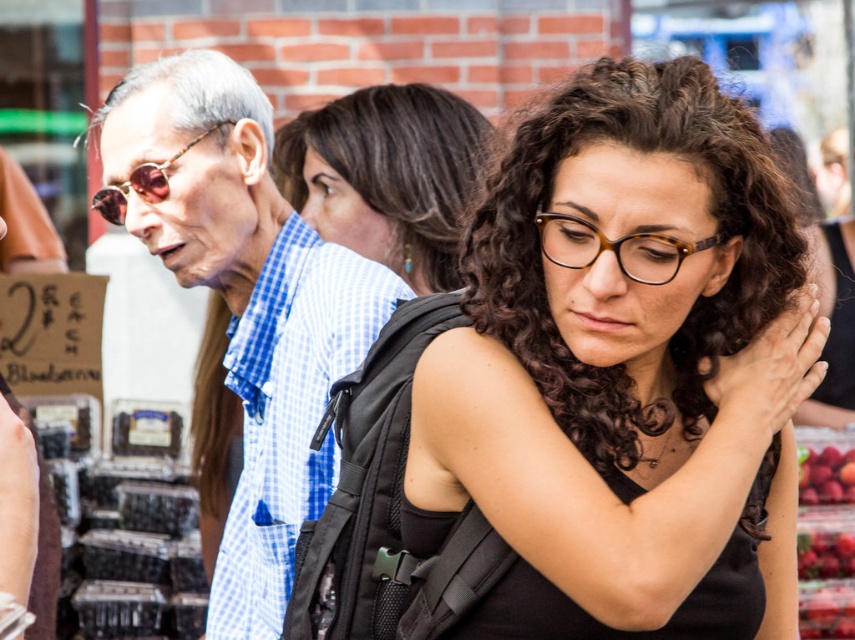
Question: Which of the following is the closest to the observer?

Choices:
 (A) black matte vest at center
 (B) matte black sunglasses at left
 (C) ripe red berries at lower right

Answer: (A)

Question: Considering the relative positions of shiny red strawberries at right and sunglassesmetallicglasses at left in the image provided, where is shiny red strawberries at right located with respect to sunglassesmetallicglasses at left?

Choices:
 (A) below
 (B) above

Answer: (A)

Question: Which point appears farthest from the camera in this image?

Choices:
 (A) (827, 541)
 (B) (736, 358)
 (C) (800, 496)
 (D) (143, 195)

Answer: (C)

Question: Estimate the real-world distances between objects in this image. Which object is farther from the dark brown curly hair at center?

Choices:
 (A) shiny red strawberries at right
 (B) matte black sunglasses at left
 (C) ripe red berries at lower right

Answer: (C)

Question: From the image, what is the correct spatial relationship of matte black sunglasses at left in relation to sunglassesmetallicglasses at left?

Choices:
 (A) left
 (B) right

Answer: (B)

Question: Is matte black sunglasses at left to the right of dark brown curly hair at center from the viewer's perspective?

Choices:
 (A) yes
 (B) no

Answer: (B)